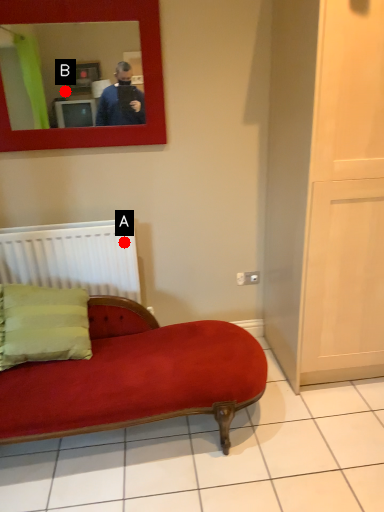
Question: Two points are circled on the image, labeled by A and B beside each circle. Which point appears closest to the camera in this image?

Choices:
 (A) A is closer
 (B) B is closer

Answer: (B)